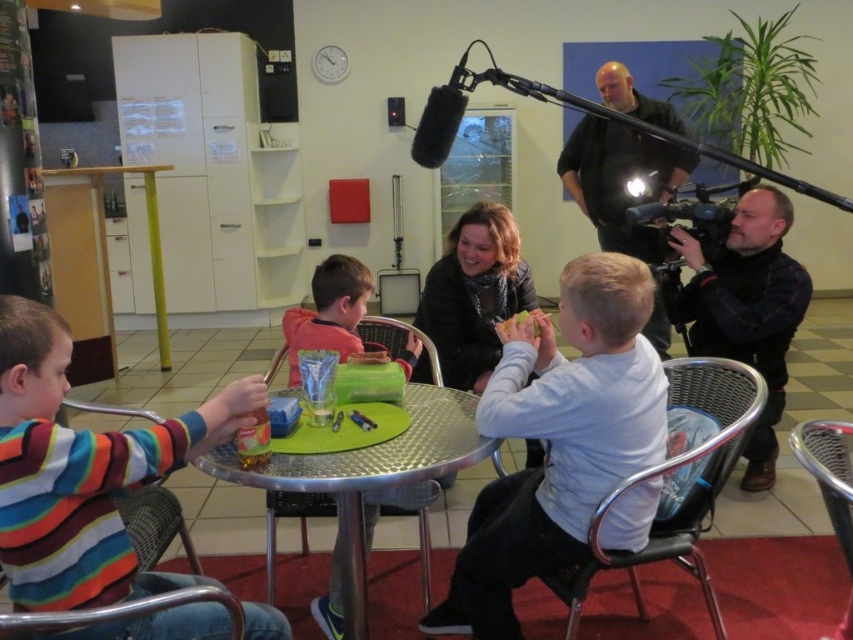
Question: Observing the image, what is the correct spatial positioning of white matte shirt at center in reference to black leather jacket at right?

Choices:
 (A) below
 (B) above

Answer: (A)

Question: Based on their relative distances, which object is farther from the metallic silver table at center?

Choices:
 (A) dark gray shirt at upper right
 (B) white matte shirt at center

Answer: (A)

Question: Which object appears closest to the camera in this image?

Choices:
 (A) orange shirt at center
 (B) striped cotton shirt at left

Answer: (B)

Question: Which point is closer to the camera taking this photo?

Choices:
 (A) (410, 467)
 (B) (329, 300)

Answer: (A)

Question: Is striped cotton shirt at left thinner than orange shirt at center?

Choices:
 (A) yes
 (B) no

Answer: (B)

Question: Observing the image, what is the correct spatial positioning of black leather jacket at right in reference to metallic silver table at center?

Choices:
 (A) left
 (B) right

Answer: (B)